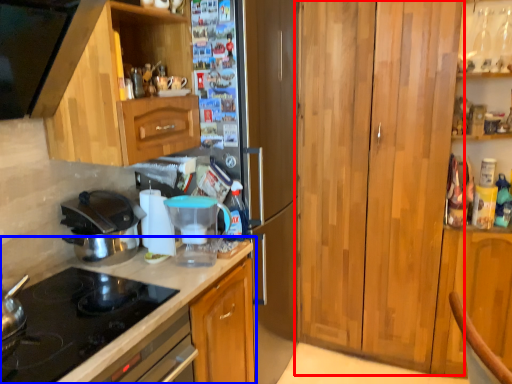
Question: Which point is further to the camera, cabinetry (highlighted by a red box) or countertop (highlighted by a blue box)?

Choices:
 (A) cabinetry
 (B) countertop

Answer: (A)